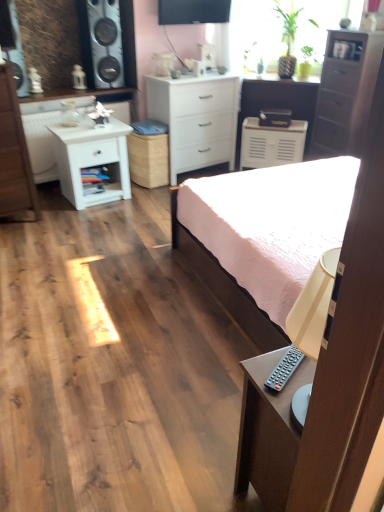
Question: From a real-world perspective, is white matte chest of drawers at center, which is the second chest of drawers in left-to-right order, physically above green leafy plant at upper right?

Choices:
 (A) yes
 (B) no

Answer: (B)

Question: Is white matte chest of drawers at center, which is the second chest of drawers in right-to-left order, not inside green leafy plant at upper right?

Choices:
 (A) no
 (B) yes

Answer: (B)

Question: From a real-world perspective, is white matte chest of drawers at center, which is the second chest of drawers in right-to-left order, located beneath green leafy plant at upper right?

Choices:
 (A) yes
 (B) no

Answer: (A)

Question: Is white matte chest of drawers at center, which is the second chest of drawers in left-to-right order, taller than green leafy plant at upper right?

Choices:
 (A) no
 (B) yes

Answer: (B)

Question: Is white matte chest of drawers at center, which is the second chest of drawers in left-to-right order, smaller than green leafy plant at upper right?

Choices:
 (A) yes
 (B) no

Answer: (B)

Question: Is white matte chest of drawers at center, which is the second chest of drawers in left-to-right order, positioned behind green leafy plant at upper right?

Choices:
 (A) no
 (B) yes

Answer: (A)

Question: Does white matte chest of drawers at center, which is the second chest of drawers in left-to-right order, have a smaller size compared to pink fabric bed at center?

Choices:
 (A) no
 (B) yes

Answer: (B)

Question: Is white matte chest of drawers at center, which is the second chest of drawers in right-to-left order, bigger than pink fabric bed at center?

Choices:
 (A) yes
 (B) no

Answer: (B)

Question: From a real-world perspective, is white matte chest of drawers at center, which is the second chest of drawers in left-to-right order, positioned over pink fabric bed at center based on gravity?

Choices:
 (A) no
 (B) yes

Answer: (B)

Question: Are white matte chest of drawers at center, which is the second chest of drawers in left-to-right order, and pink fabric bed at center making contact?

Choices:
 (A) no
 (B) yes

Answer: (A)

Question: Can you confirm if white matte chest of drawers at center, which is the second chest of drawers in left-to-right order, is thinner than pink fabric bed at center?

Choices:
 (A) no
 (B) yes

Answer: (B)

Question: Does white matte chest of drawers at center, which is the second chest of drawers in left-to-right order, appear on the right side of pink fabric bed at center?

Choices:
 (A) yes
 (B) no

Answer: (B)

Question: From a real-world perspective, is white matte chest of drawers at center, which is the second chest of drawers in left-to-right order, on top of white wood chest of drawers at left, acting as the first chest of drawers starting from the left?

Choices:
 (A) yes
 (B) no

Answer: (B)